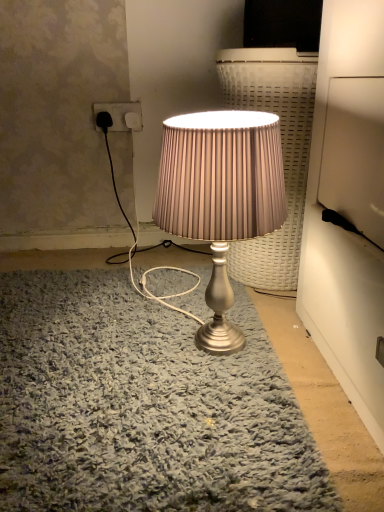
The height and width of the screenshot is (512, 384). Find the location of `satin silver lamp at center`. satin silver lamp at center is located at coordinates (220, 197).

What do you see at coordinates (220, 197) in the screenshot? I see `satin silver lamp at center` at bounding box center [220, 197].

Measure the distance between matte white socket at upper left and camera.

matte white socket at upper left and camera are 4.31 feet apart.

Describe the element at coordinates (120, 115) in the screenshot. This screenshot has width=384, height=512. I see `matte white socket at upper left` at that location.

You are a GUI agent. You are given a task and a screenshot of the screen. Output one action in this format:
    pyautogui.click(x=<x>, y=<y>)
    Task: Click on the matte white socket at upper left
    Image resolution: width=384 pixels, height=512 pixels.
    Given the screenshot: What is the action you would take?
    pyautogui.click(x=120, y=115)

Where is `satin silver lamp at center`? Image resolution: width=384 pixels, height=512 pixels. satin silver lamp at center is located at coordinates (220, 197).

Consider the image. Between satin silver lamp at center and matte white socket at upper left, which one appears on the left side from the viewer's perspective?

matte white socket at upper left is more to the left.

Looking at this image, considering the relative positions of satin silver lamp at center and matte white socket at upper left in the image provided, is satin silver lamp at center in front of matte white socket at upper left?

That is True.

Considering the positions of point (258, 208) and point (108, 118), is point (258, 208) closer or farther from the camera than point (108, 118)?

Clearly, point (258, 208) is closer to the camera than point (108, 118).

From the image's perspective, is satin silver lamp at center located beneath matte white socket at upper left?

Indeed, from the image's perspective, satin silver lamp at center is shown beneath matte white socket at upper left.

From a real-world perspective, is satin silver lamp at center physically below matte white socket at upper left?

Yes, from a real-world perspective, satin silver lamp at center is beneath matte white socket at upper left.

Considering the relative sizes of satin silver lamp at center and matte white socket at upper left in the image provided, is satin silver lamp at center wider than matte white socket at upper left?

Yes, satin silver lamp at center is wider than matte white socket at upper left.

Does satin silver lamp at center have a lesser height compared to matte white socket at upper left?

No, satin silver lamp at center is not shorter than matte white socket at upper left.

Is satin silver lamp at center bigger or smaller than matte white socket at upper left?

Considering their sizes, satin silver lamp at center takes up more space than matte white socket at upper left.

Can matte white socket at upper left be found inside satin silver lamp at center?

That's incorrect, matte white socket at upper left is not inside satin silver lamp at center.

Can you see satin silver lamp at center touching matte white socket at upper left?

No, satin silver lamp at center is not making contact with matte white socket at upper left.

Is satin silver lamp at center facing away from matte white socket at upper left?

No, satin silver lamp at center's orientation is not away from matte white socket at upper left.

How different are the orientations of satin silver lamp at center and matte white socket at upper left in degrees?

91.4 degrees.

At what (x,y) coordinates should I click in order to perform the action: click on lamp on the right side of matte white socket at upper left. Please return your answer as a coordinate pair (x, y). The width and height of the screenshot is (384, 512). Looking at the image, I should click on (220, 197).

Does matte white socket at upper left appear on the right side of satin silver lamp at center?

In fact, matte white socket at upper left is to the left of satin silver lamp at center.

Between matte white socket at upper left and satin silver lamp at center, which one is positioned behind?

matte white socket at upper left is behind.

Is point (139, 111) closer to viewer compared to point (219, 298)?

No, (139, 111) is further to viewer.

From the image's perspective, is matte white socket at upper left above or below satin silver lamp at center?

matte white socket at upper left is above satin silver lamp at center.

From a real-world perspective, is matte white socket at upper left under satin silver lamp at center?

No, from a real-world perspective, matte white socket at upper left is not beneath satin silver lamp at center.

Which object is wider, matte white socket at upper left or satin silver lamp at center?

satin silver lamp at center.

Considering the relative sizes of matte white socket at upper left and satin silver lamp at center in the image provided, is matte white socket at upper left taller than satin silver lamp at center?

No.

From the picture: Who is bigger, matte white socket at upper left or satin silver lamp at center?

Bigger between the two is satin silver lamp at center.

Can we say matte white socket at upper left lies outside satin silver lamp at center?

Indeed, matte white socket at upper left is completely outside satin silver lamp at center.

Is matte white socket at upper left far away from satin silver lamp at center?

Actually, matte white socket at upper left and satin silver lamp at center are a little close together.

Is matte white socket at upper left positioned with its back to satin silver lamp at center?

No, matte white socket at upper left is not facing away from satin silver lamp at center.

At what (x,y) coordinates should I click in order to perform the action: click on lamp that appears below the matte white socket at upper left (from the image's perspective). Please return your answer as a coordinate pair (x, y). The width and height of the screenshot is (384, 512). Looking at the image, I should click on coord(220,197).

This screenshot has width=384, height=512. I want to click on electric outlet that is behind the satin silver lamp at center, so click(120, 115).

In the image, there is a matte white socket at upper left. Where is `lamp below it (from a real-world perspective)`? lamp below it (from a real-world perspective) is located at coordinates (220, 197).